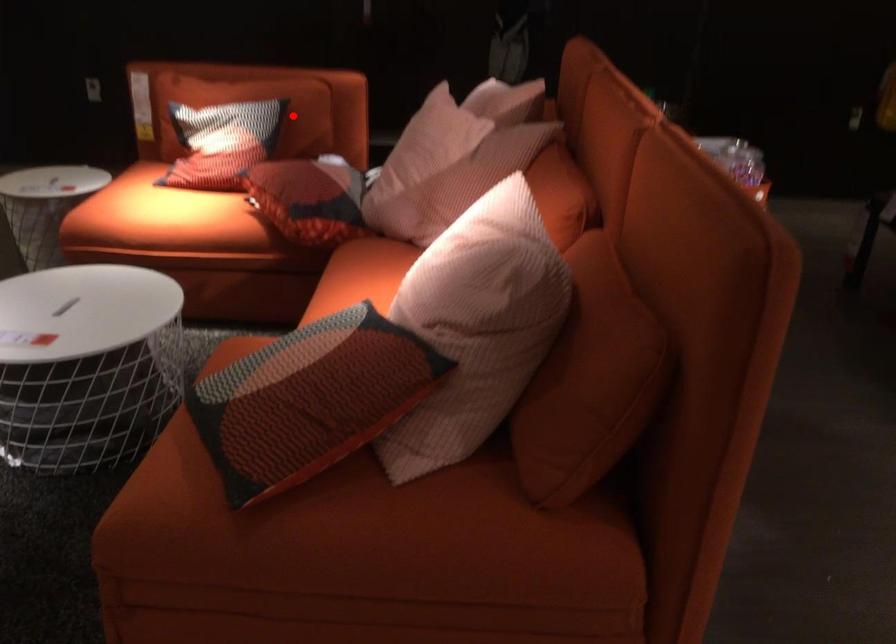
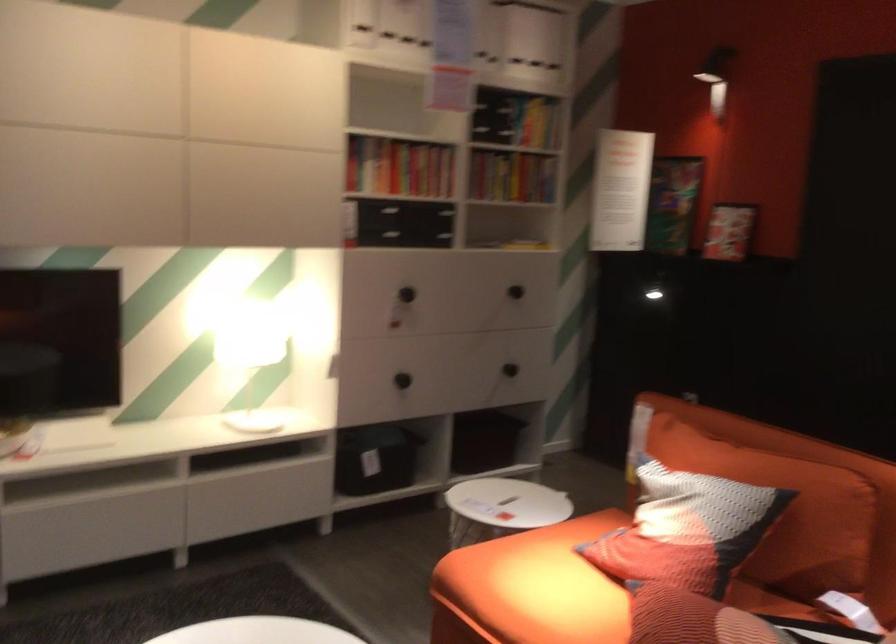
Where in the second image is the point corresponding to the highlighted location from the first image?

(785, 511)